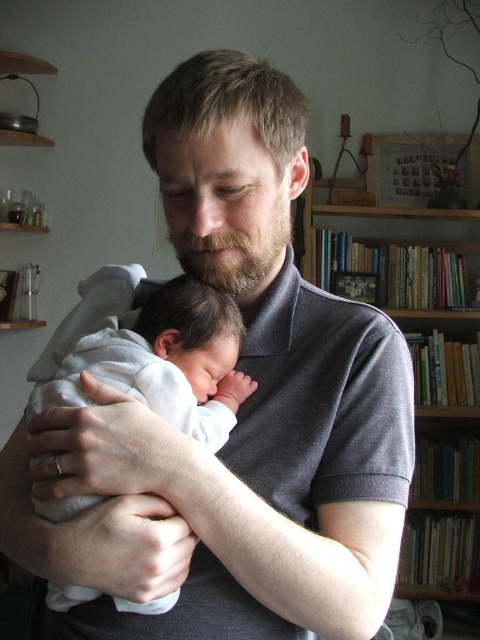
You are an interior designer planning to place a new decorative item between the wooden bookshelf at upper right and the brown fuzzy beard at center. Which object should you place the item closer to if you want it to appear closer to the viewer?

The wooden bookshelf at upper right is closer to the viewer than the brown fuzzy beard at center, so placing the decorative item closer to the wooden bookshelf at upper right would make it appear closer to the viewer.

You are a photographer taking a portrait of the adult holding the baby. You need to ensure that both the white soft baby at center and the brown fuzzy beard at center are clearly visible. Given their sizes, which one might require more careful framing to avoid being too small in the photo?

The brown fuzzy beard at center is smaller than the white soft baby at center, so it might require more careful framing to ensure it is not too small in the photo.

You are a photographer positioned in front of the wooden bookshelf at upper right and the white soft baby at center. Which object is closer to you?

The wooden bookshelf at upper right is closer to you because it is positioned further to the viewer than the white soft baby at center.